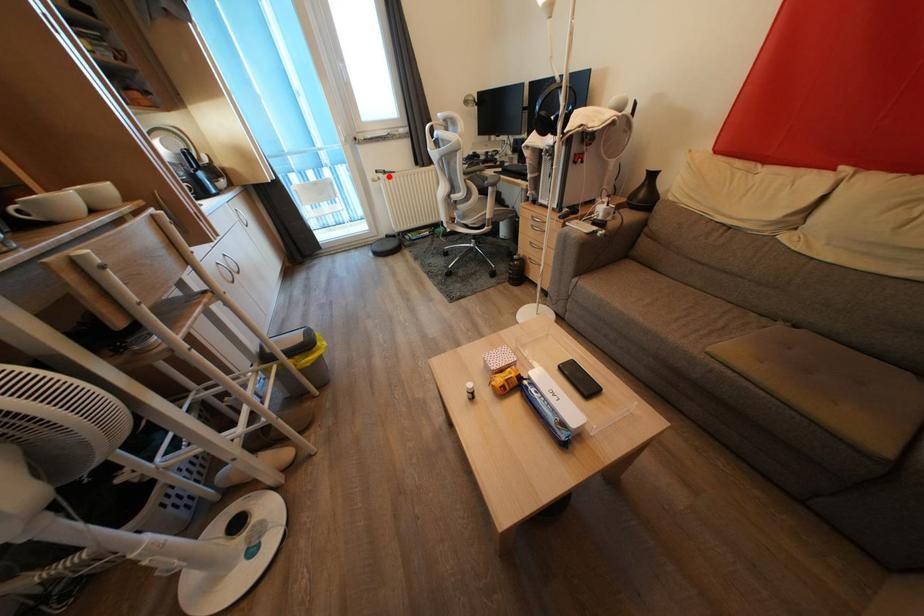
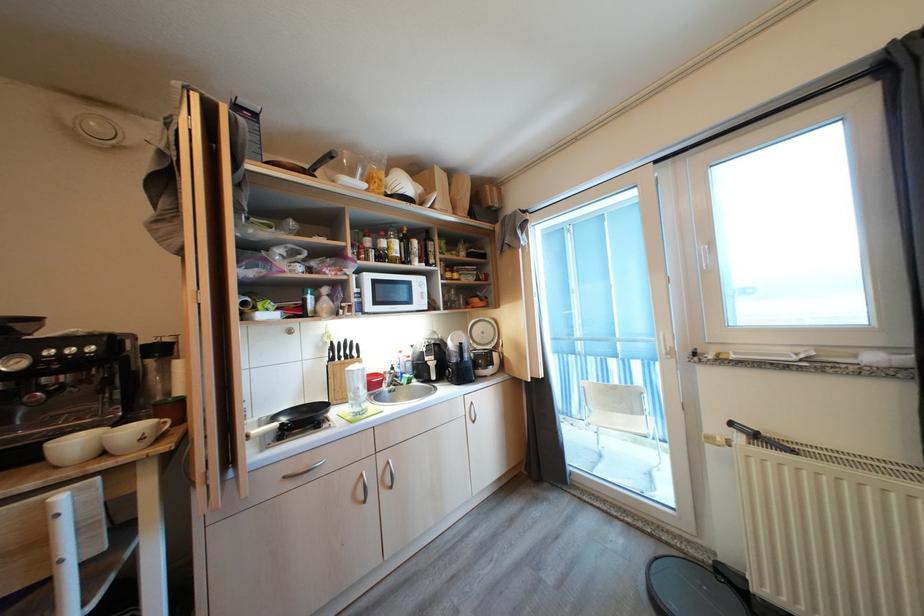
Locate, in the second image, the point that corresponds to the highlighted location in the first image.

(760, 440)